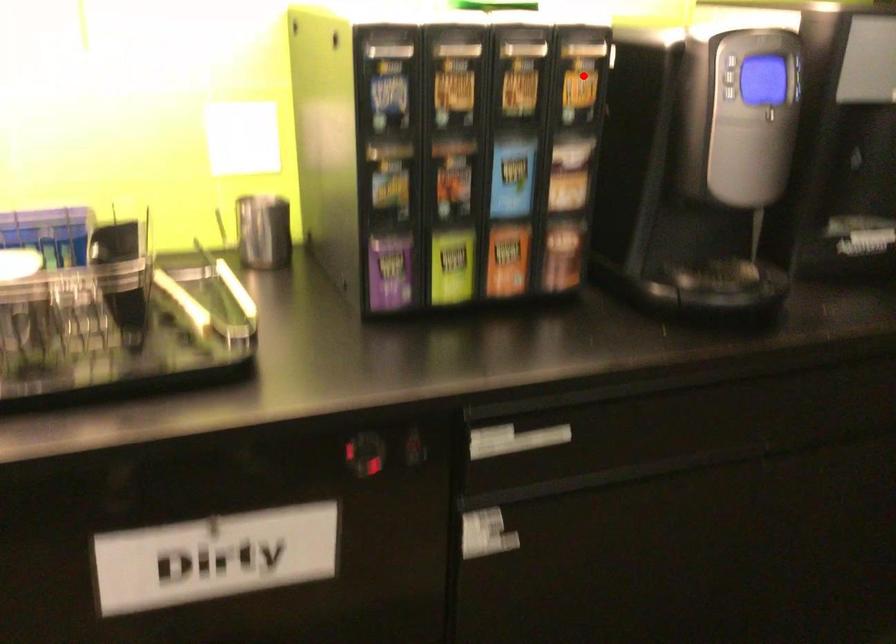
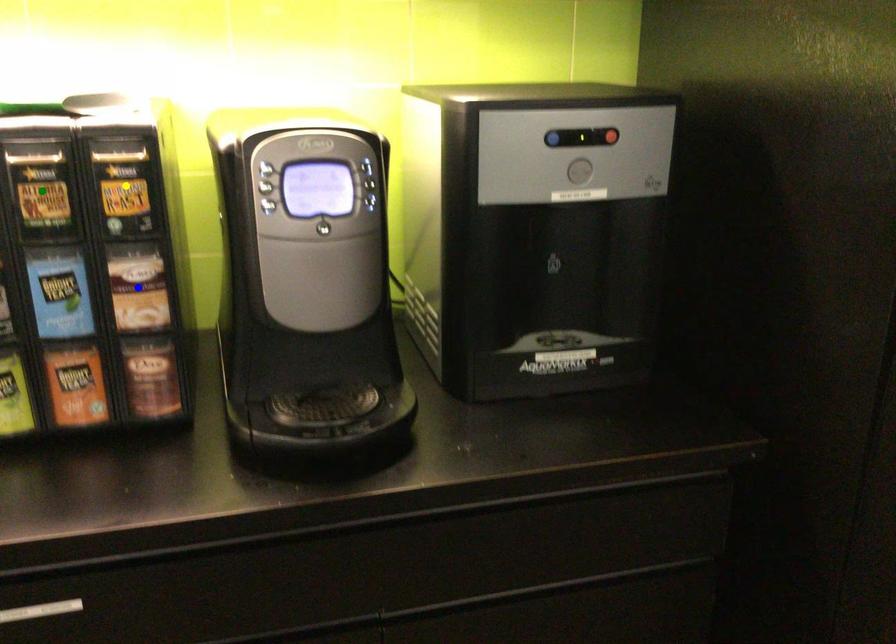
Question: I am providing you with two images of the same scene from different viewpoints. A red point is marked on the first image. You are given multiple points on the second image. Can you choose the point in image 2 that corresponds to the point in image 1?

Choices:
 (A) green point
 (B) yellow point
 (C) blue point

Answer: (B)